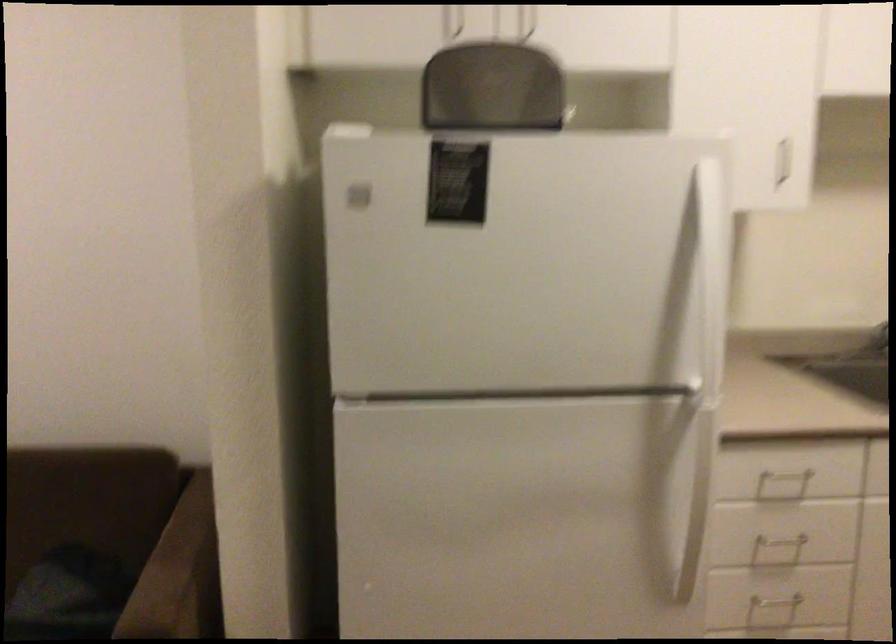
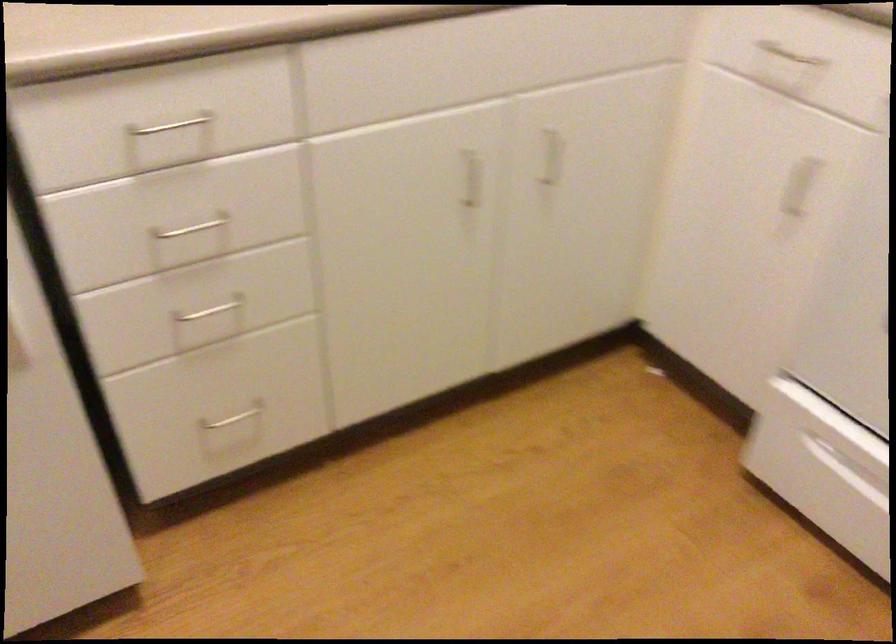
Find the pixel in the second image that matches point 785,471 in the first image.

(170, 125)